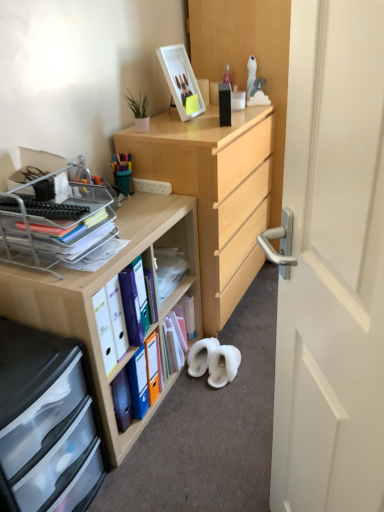
Question: Is multicolored plastic pen holder at upper left completely or partially outside of wooden desk at center?

Choices:
 (A) no
 (B) yes

Answer: (B)

Question: From a real-world perspective, is multicolored plastic pen holder at upper left on wooden desk at center?

Choices:
 (A) yes
 (B) no

Answer: (A)

Question: Does multicolored plastic pen holder at upper left have a smaller size compared to wooden desk at center?

Choices:
 (A) no
 (B) yes

Answer: (B)

Question: Is wooden desk at center a part of multicolored plastic pen holder at upper left?

Choices:
 (A) no
 (B) yes

Answer: (A)

Question: Is multicolored plastic pen holder at upper left shorter than wooden desk at center?

Choices:
 (A) no
 (B) yes

Answer: (B)

Question: Does multicolored plastic pen holder at upper left turn towards wooden desk at center?

Choices:
 (A) no
 (B) yes

Answer: (A)

Question: From a real-world perspective, is multicolored plastic pen holder at upper left below white glossy picture frame at upper center?

Choices:
 (A) no
 (B) yes

Answer: (B)

Question: Is multicolored plastic pen holder at upper left smaller than white glossy picture frame at upper center?

Choices:
 (A) no
 (B) yes

Answer: (B)

Question: Is multicolored plastic pen holder at upper left outside white glossy picture frame at upper center?

Choices:
 (A) yes
 (B) no

Answer: (A)

Question: Considering the relative positions of multicolored plastic pen holder at upper left and white glossy picture frame at upper center in the image provided, is multicolored plastic pen holder at upper left to the right of white glossy picture frame at upper center from the viewer's perspective?

Choices:
 (A) no
 (B) yes

Answer: (A)

Question: From the image's perspective, is multicolored plastic pen holder at upper left over white glossy picture frame at upper center?

Choices:
 (A) yes
 (B) no

Answer: (B)

Question: Considering the relative positions of multicolored plastic pen holder at upper left and white glossy picture frame at upper center in the image provided, is multicolored plastic pen holder at upper left to the left of white glossy picture frame at upper center from the viewer's perspective?

Choices:
 (A) no
 (B) yes

Answer: (B)

Question: Does wooden desk at center have a lesser height compared to multicolored plastic pen holder at upper left?

Choices:
 (A) yes
 (B) no

Answer: (B)